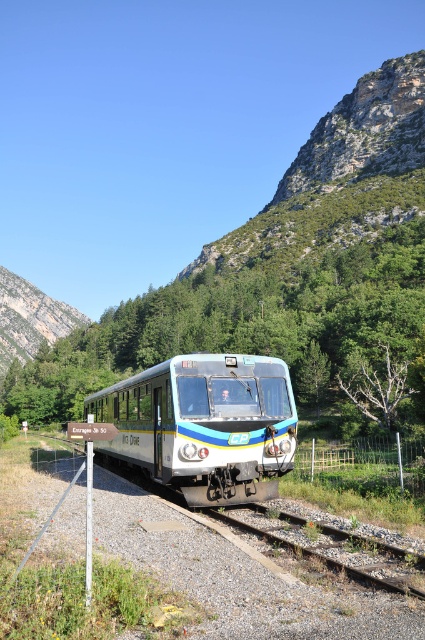
Question: Does metallic silver train at center appear on the left side of brown gravel train track at lower center?

Choices:
 (A) no
 (B) yes

Answer: (B)

Question: Can you confirm if metallic silver train at center is wider than rugged stone mountain at upper left?

Choices:
 (A) yes
 (B) no

Answer: (B)

Question: Which of the following is the closest to the observer?

Choices:
 (A) (129, 388)
 (B) (14, 280)

Answer: (A)

Question: Which point appears farthest from the camera in this image?

Choices:
 (A) (328, 515)
 (B) (184, 356)

Answer: (B)

Question: Which point appears farthest from the camera in this image?

Choices:
 (A) (59, 324)
 (B) (189, 358)

Answer: (A)

Question: Can you confirm if metallic silver train at center is positioned below rugged stone mountain at upper left?

Choices:
 (A) no
 (B) yes

Answer: (B)